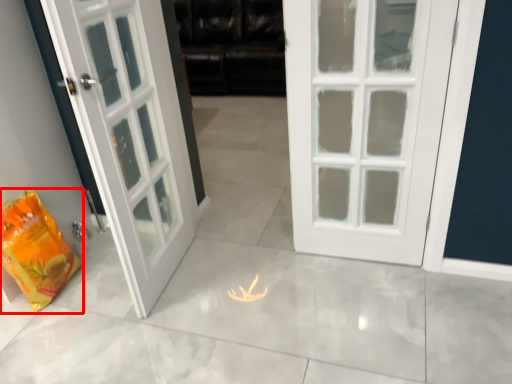
Question: In this image, where is shopping bag (annotated by the red box) located relative to dark?

Choices:
 (A) left
 (B) right

Answer: (A)